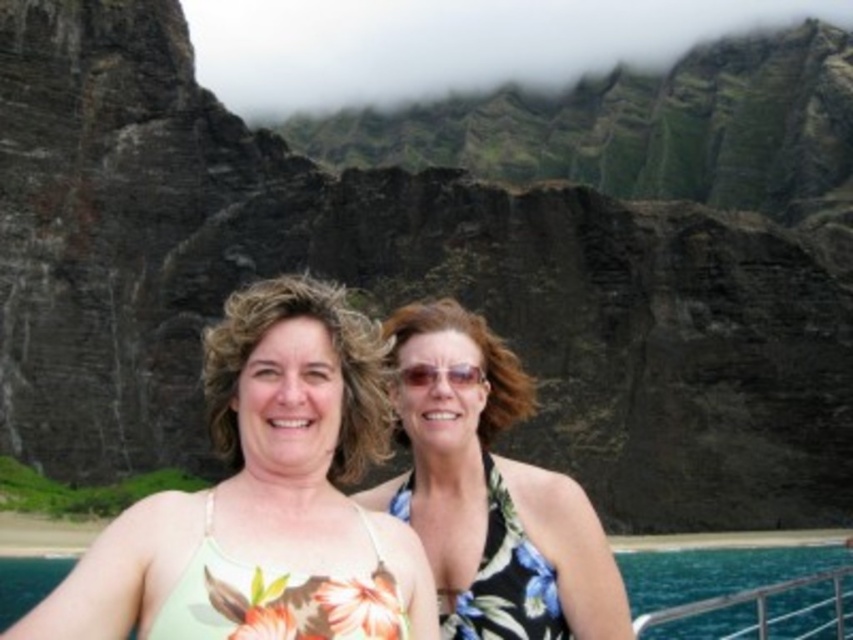
Question: Is green floral swimsuit at center bigger than green floral swimsuit at lower center?

Choices:
 (A) no
 (B) yes

Answer: (B)

Question: Which object appears farthest from the camera in this image?

Choices:
 (A) green floral swimsuit at center
 (B) floral print bikini top at center

Answer: (B)

Question: Which of the following is the farthest from the observer?

Choices:
 (A) green floral swimsuit at center
 (B) floral print bikini top at center
 (C) green floral swimsuit at lower center

Answer: (C)

Question: Is floral print bikini top at center positioned before green floral swimsuit at lower center?

Choices:
 (A) no
 (B) yes

Answer: (B)

Question: Does green floral swimsuit at center have a greater width compared to floral print bikini top at center?

Choices:
 (A) no
 (B) yes

Answer: (B)

Question: Which object is positioned closest to the green floral swimsuit at center?

Choices:
 (A) floral print bikini top at center
 (B) green floral swimsuit at lower center

Answer: (A)